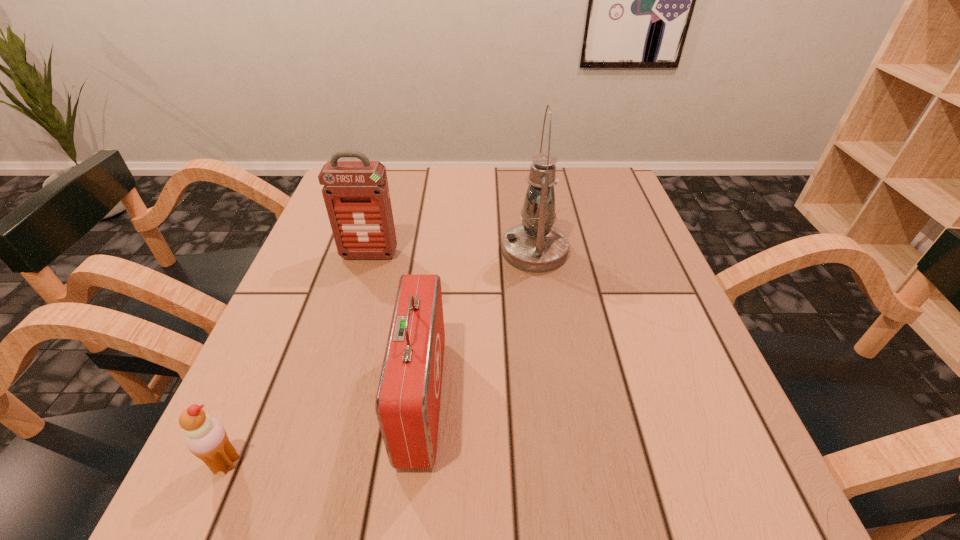
You are a GUI agent. You are given a task and a screenshot of the screen. Output one action in this format:
    pyautogui.click(x=<x>, y=<y>)
    Task: Click on the rightmost object
    
    Given the screenshot: What is the action you would take?
    pyautogui.click(x=535, y=246)

Where is `the tallest object`? the tallest object is located at coordinates (535, 246).

Find the location of a particular element. the taller first-aid kit is located at coordinates (356, 194).

The image size is (960, 540). Find the location of `the second object from left to right`. the second object from left to right is located at coordinates (356, 194).

In order to click on the second object from right to left in this screenshot , I will do `click(407, 406)`.

Locate an element on the screen. the shorter first-aid kit is located at coordinates (407, 406).

Where is `the leftmost object`? The image size is (960, 540). the leftmost object is located at coordinates (206, 438).

Locate an element on the screen. This screenshot has width=960, height=540. icecream is located at coordinates (206, 438).

Where is `free region located on the left of the tallest object`? The height and width of the screenshot is (540, 960). free region located on the left of the tallest object is located at coordinates (399, 251).

I want to click on vacant space located 0.250m on the front-facing side of the farther first-aid kit, so pyautogui.click(x=341, y=351).